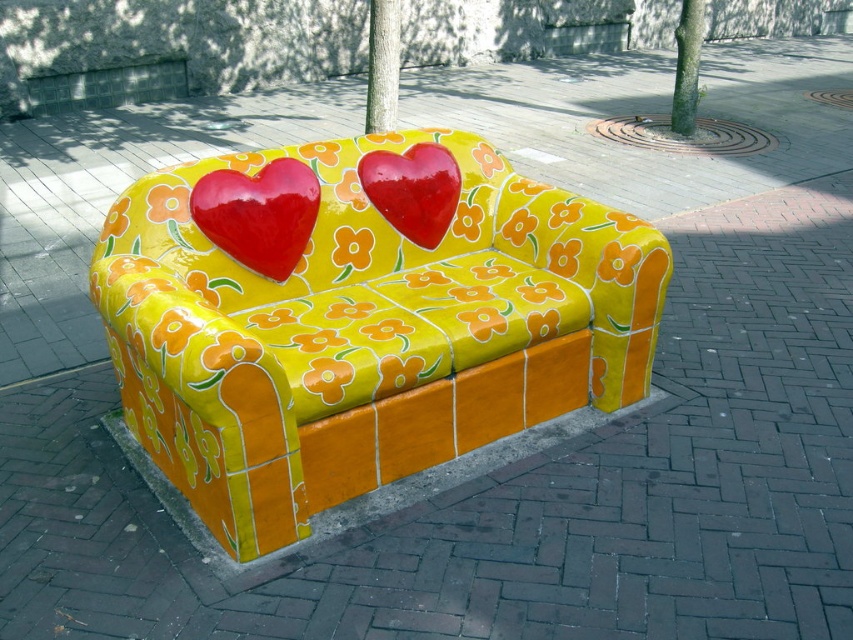
You are standing on the paved area and want to walk from the yellow glossy couch at center to the orange tile curb at lower center. Which direction should you move to reach the curb?

The yellow glossy couch at center is to the left of orange tile curb at lower center, so you should move to the right to reach the curb.

You are a painter standing at the edge of the paved area where the bench is located. You need to paint both the glossy red heart at center and the glossy ceramic heart at center. If your paintbrush has a maximum reach of 35 centimeters, can you paint both hearts without moving your position?

The distance between the glossy red heart at center and the glossy ceramic heart at center is 38.28 centimeters. Since your paintbrush can only reach up to 35 centimeters, you cannot paint both hearts without moving your position because the distance exceeds your reach.